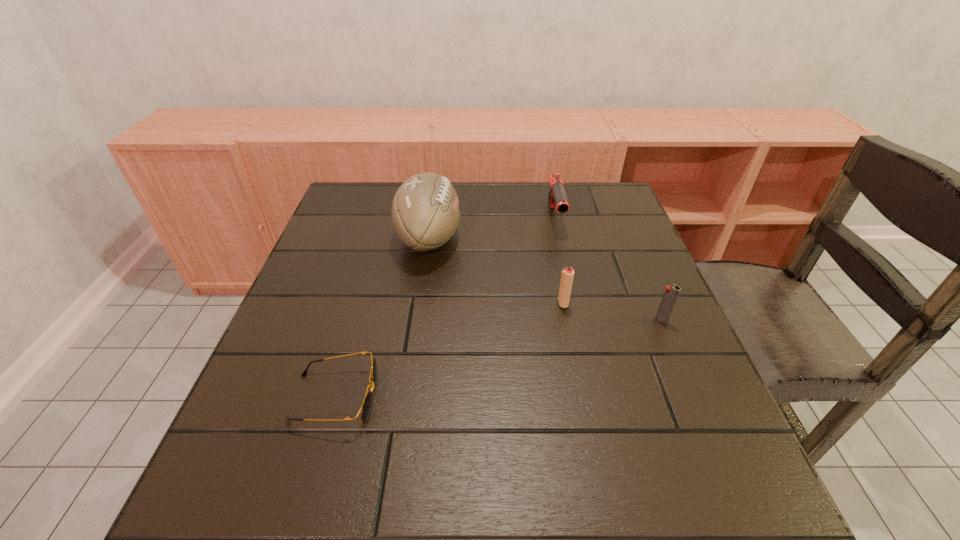
Find the location of a particular element. This screenshot has width=960, height=540. vacant space at the right edge of the desktop is located at coordinates (591, 250).

Where is `vacant region at the far left corner of the desktop`? The height and width of the screenshot is (540, 960). vacant region at the far left corner of the desktop is located at coordinates click(x=349, y=209).

Locate an element on the screen. free location at the near left corner of the desktop is located at coordinates (232, 521).

In the image, there is a desktop. Identify the location of vacant space at the far right corner. The width and height of the screenshot is (960, 540). (574, 206).

In the image, there is a desktop. Identify the location of vacant space at the near right corner. (688, 501).

What are the coordinates of `vacant area that lies between the sunglasses and the gun` in the screenshot? It's located at (445, 308).

Find the location of `unoccupied area between the tallest object and the shortest object`. unoccupied area between the tallest object and the shortest object is located at coordinates (382, 318).

Locate an element on the screen. free space between the nearest object and the gun is located at coordinates (445, 308).

Image resolution: width=960 pixels, height=540 pixels. Find the location of `free spot between the nearest object and the gun`. free spot between the nearest object and the gun is located at coordinates (445, 308).

This screenshot has height=540, width=960. Find the location of `free space between the sunglasses and the gun`. free space between the sunglasses and the gun is located at coordinates (445, 308).